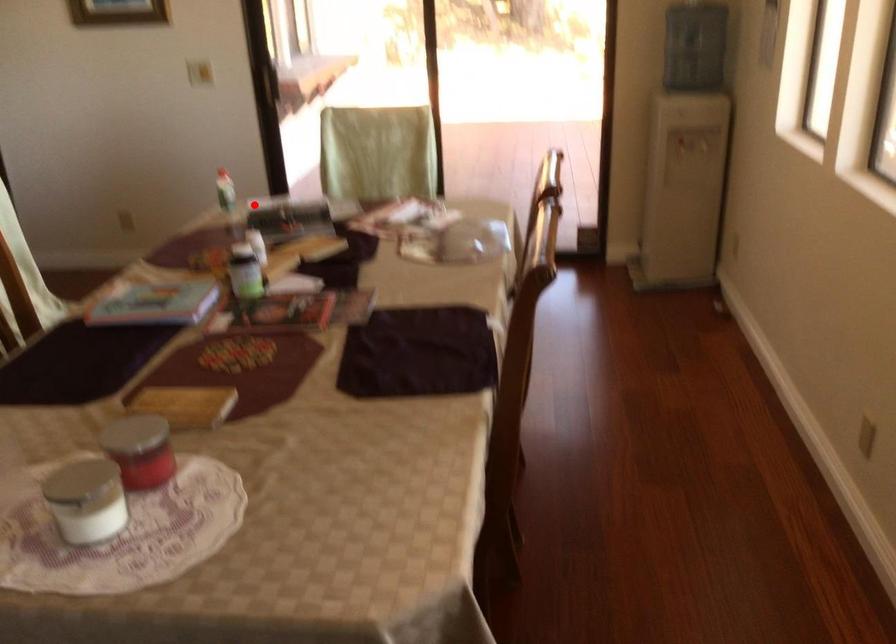
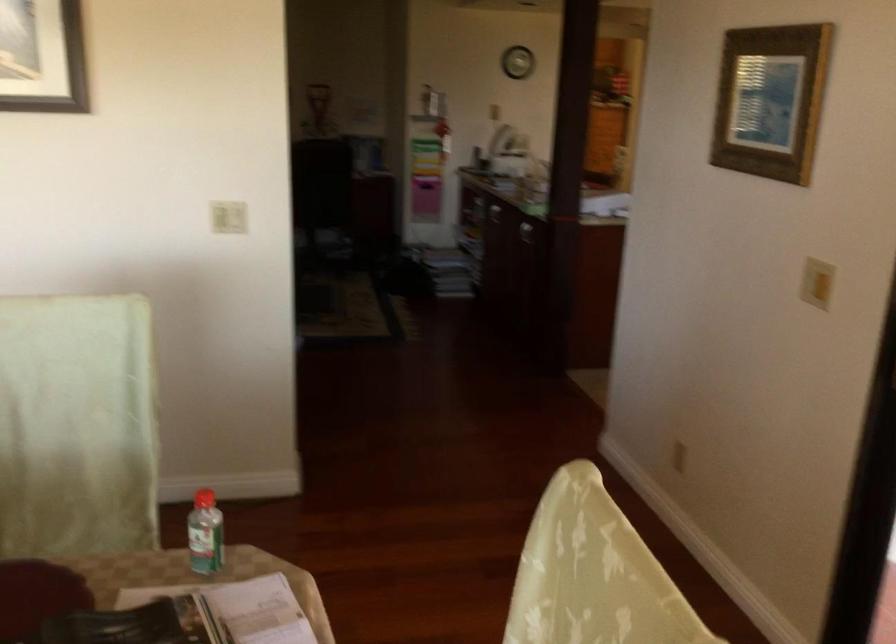
Where in the second image is the point corresponding to the highlighted location from the first image?

(238, 609)